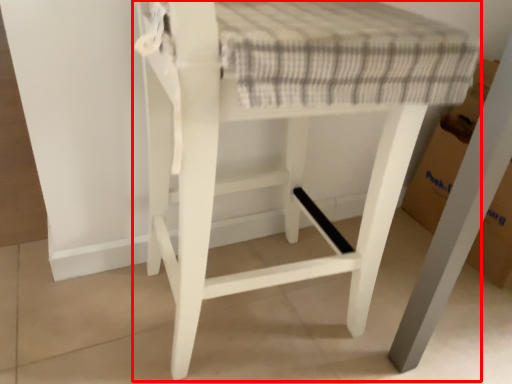
Question: From the image's perspective, where is furniture (annotated by the red box) located in relation to cardboard box in the image?

Choices:
 (A) below
 (B) above

Answer: (A)